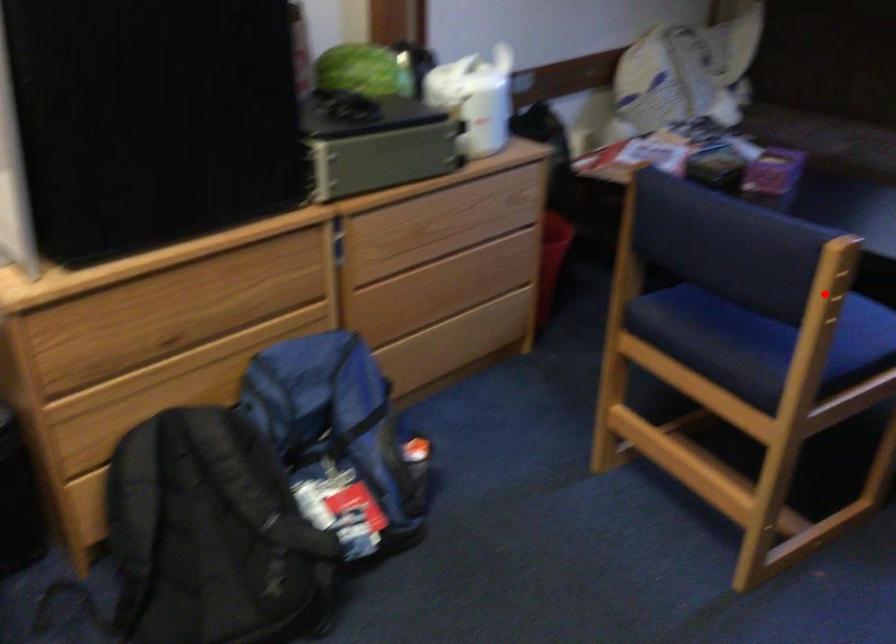
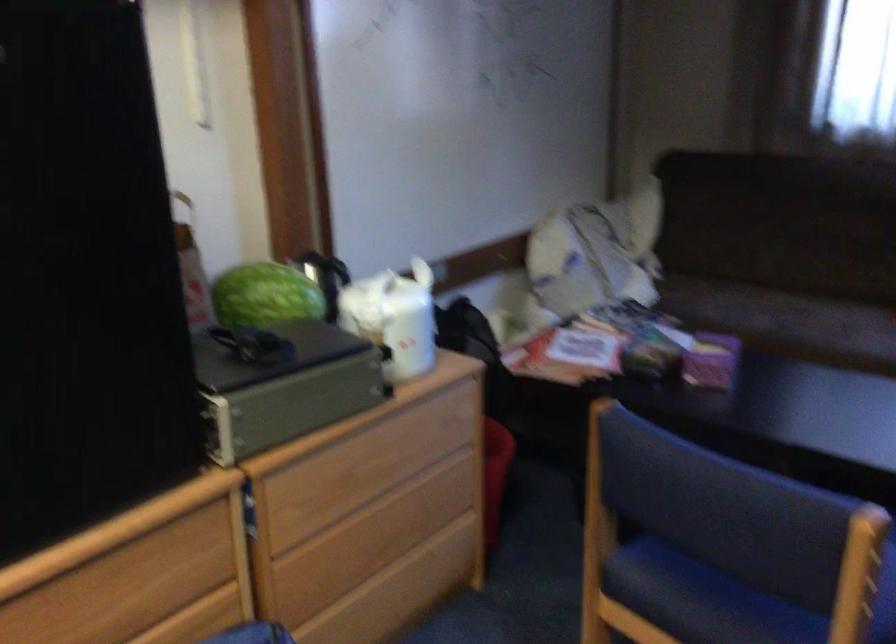
Locate, in the second image, the point that corresponds to the highlighted location in the first image.

(858, 574)